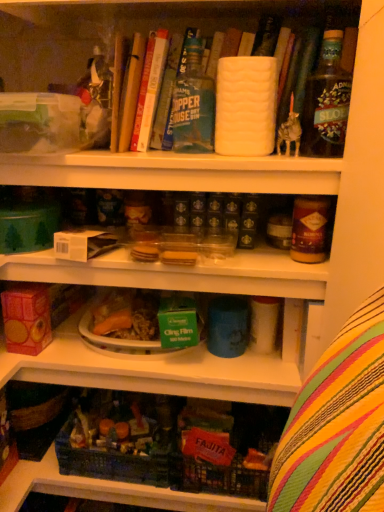
Question: From a real-world perspective, is hardcover book at upper center, arranged as the first book when viewed from the left, under green glass bottle at upper right, positioned as the 2th bottle in left-to-right order?

Choices:
 (A) yes
 (B) no

Answer: (A)

Question: Is there a large distance between hardcover book at upper center, which is the 3th book from right to left, and green glass bottle at upper right, positioned as the 2th bottle in left-to-right order?

Choices:
 (A) no
 (B) yes

Answer: (A)

Question: Would you say hardcover book at upper center, arranged as the first book when viewed from the left, contains green glass bottle at upper right, positioned as the 2th bottle in left-to-right order?

Choices:
 (A) no
 (B) yes

Answer: (A)

Question: Is hardcover book at upper center, arranged as the first book when viewed from the left, wider than green glass bottle at upper right, positioned as the 2th bottle in left-to-right order?

Choices:
 (A) yes
 (B) no

Answer: (A)

Question: Considering the relative positions of hardcover book at upper center, which is the 3th book from right to left, and green glass bottle at upper right, positioned as the 2th bottle in left-to-right order, in the image provided, is hardcover book at upper center, which is the 3th book from right to left, to the right of green glass bottle at upper right, positioned as the 2th bottle in left-to-right order, from the viewer's perspective?

Choices:
 (A) no
 (B) yes

Answer: (A)

Question: In terms of height, does translucent plastic container at center, marked as the first shelf in a bottom-to-top arrangement, look taller or shorter compared to hardcover book at upper center, which is the second book from left to right?

Choices:
 (A) tall
 (B) short

Answer: (B)

Question: Is point (72, 331) closer or farther from the camera than point (137, 117)?

Choices:
 (A) closer
 (B) farther

Answer: (B)

Question: From a real-world perspective, is translucent plastic container at center, the 2th shelf positioned from the top, positioned above or below hardcover book at upper center, which is the second book from left to right?

Choices:
 (A) above
 (B) below

Answer: (B)

Question: In the image, is translucent plastic container at center, marked as the first shelf in a bottom-to-top arrangement, on the left side or the right side of hardcover book at upper center, which is the second book from left to right?

Choices:
 (A) left
 (B) right

Answer: (A)

Question: In the image, is brown glass jar at upper right on the left side or the right side of matte brown jar at upper right?

Choices:
 (A) left
 (B) right

Answer: (B)

Question: Looking at the image, does brown glass jar at upper right seem bigger or smaller compared to matte brown jar at upper right?

Choices:
 (A) big
 (B) small

Answer: (B)

Question: Is brown glass jar at upper right spatially inside matte brown jar at upper right, or outside of it?

Choices:
 (A) inside
 (B) outside

Answer: (B)

Question: Is brown glass jar at upper right wider or thinner than matte brown jar at upper right?

Choices:
 (A) thin
 (B) wide

Answer: (A)

Question: Looking at their shapes, would you say translucent plastic container at center, the 2th shelf positioned from the top, is wider or thinner than brown glass jar at upper right?

Choices:
 (A) wide
 (B) thin

Answer: (A)

Question: From a real-world perspective, is translucent plastic container at center, the 2th shelf positioned from the top, above or below brown glass jar at upper right?

Choices:
 (A) below
 (B) above

Answer: (A)